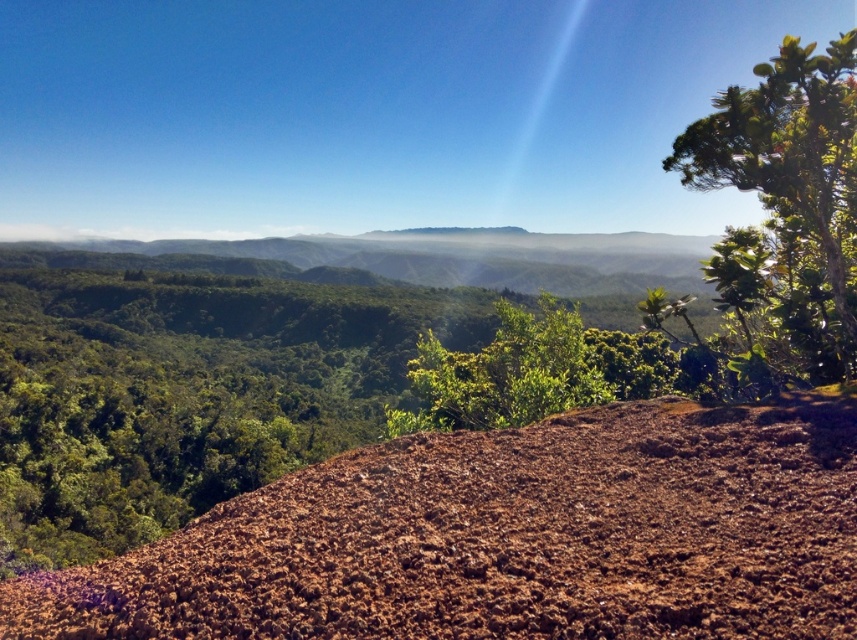
Question: Which object appears closest to the camera in this image?

Choices:
 (A) green leafy bush at center
 (B) brown textured soil at center

Answer: (B)

Question: From the image, what is the correct spatial relationship of brown textured soil at center in relation to green leafy tree at upper right?

Choices:
 (A) left
 (B) right

Answer: (A)

Question: Is green leafy tree at upper right above green leafy bush at center?

Choices:
 (A) no
 (B) yes

Answer: (B)

Question: Does green leafy tree at upper right appear on the right side of green leafy bush at center?

Choices:
 (A) yes
 (B) no

Answer: (A)

Question: Which of the following is the farthest from the observer?

Choices:
 (A) (844, 157)
 (B) (471, 358)

Answer: (B)

Question: Which point is closer to the camera?

Choices:
 (A) (456, 408)
 (B) (726, 93)

Answer: (B)